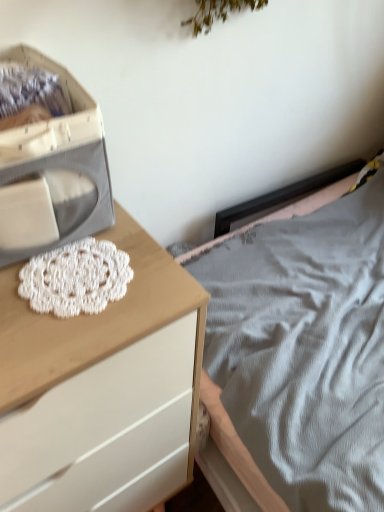
Question: Considering the positions of white fabric storage box at left and white wood chest of drawers at left in the image, is white fabric storage box at left wider or thinner than white wood chest of drawers at left?

Choices:
 (A) thin
 (B) wide

Answer: (A)

Question: Considering the relative positions of white fabric storage box at left and white wood chest of drawers at left in the image provided, is white fabric storage box at left to the left or to the right of white wood chest of drawers at left?

Choices:
 (A) right
 (B) left

Answer: (A)

Question: Which is farther from the white wood chest of drawers at left?

Choices:
 (A) white fabric storage box at left
 (B) white crochet doily at center-left

Answer: (A)

Question: Which is nearer to the white crochet doily at center-left?

Choices:
 (A) white wood chest of drawers at left
 (B) white fabric storage box at left

Answer: (B)